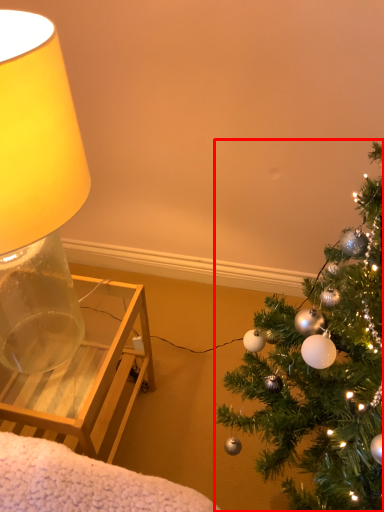
Question: Observing the image, what is the correct spatial positioning of christmas tree (annotated by the red box) in reference to lamp?

Choices:
 (A) left
 (B) right

Answer: (B)